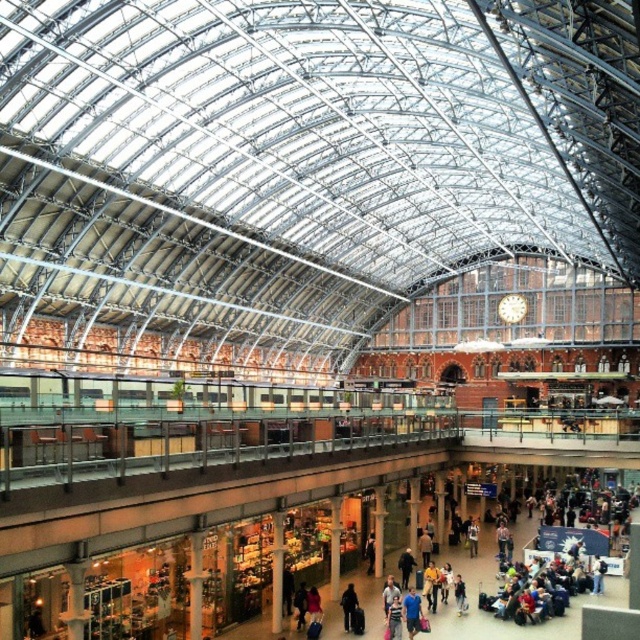
Between point (413, 612) and point (348, 602), which one is positioned behind?

The point (348, 602) is more distant.

Based on the photo, between blue cotton shirt at lower center and dark brown leather jacket at center, which one is positioned higher?

dark brown leather jacket at center is above.

Is point (410, 628) behind point (349, 605)?

No, it is not.

Identify the location of blue cotton shirt at lower center. The image size is (640, 640). (412, 612).

Is point (397, 604) closer to camera compared to point (401, 580)?

Yes, it is in front of point (401, 580).

This screenshot has width=640, height=640. Describe the element at coordinates (394, 618) in the screenshot. I see `blue denim jeans at center` at that location.

Between point (387, 620) and point (406, 564), which one is positioned behind?

Point (406, 564)

This screenshot has width=640, height=640. In order to click on blue denim jeans at center in this screenshot , I will do coord(394,618).

From the picture: Does blue cotton shirt at lower center have a greater height compared to dark blue jeans at center?

Indeed, blue cotton shirt at lower center has a greater height compared to dark blue jeans at center.

Is blue cotton shirt at lower center further to the viewer compared to dark blue jeans at center?

No, blue cotton shirt at lower center is in front of dark blue jeans at center.

You are a GUI agent. You are given a task and a screenshot of the screen. Output one action in this format:
    pyautogui.click(x=<x>, y=<y>)
    Task: Click on the blue cotton shirt at lower center
    Image resolution: width=640 pixels, height=640 pixels.
    Given the screenshot: What is the action you would take?
    click(412, 612)

Image resolution: width=640 pixels, height=640 pixels. What are the coordinates of `blue cotton shirt at lower center` in the screenshot? It's located at (412, 612).